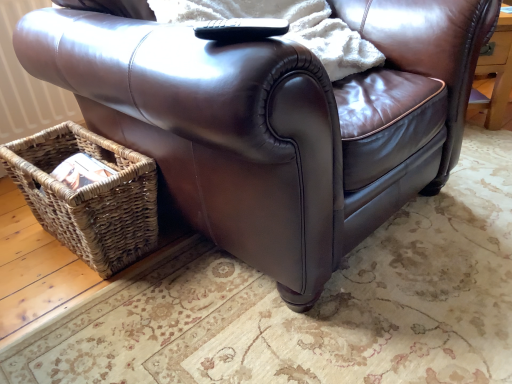
Identify the location of woven brown picnic basket at lower left. (88, 196).

Describe the element at coordinates (88, 196) in the screenshot. I see `woven brown picnic basket at lower left` at that location.

Where is `black plastic remote at upper center`? The height and width of the screenshot is (384, 512). black plastic remote at upper center is located at coordinates (240, 29).

The image size is (512, 384). What do you see at coordinates (240, 29) in the screenshot?
I see `black plastic remote at upper center` at bounding box center [240, 29].

Measure the distance between black plastic remote at upper center and camera.

26.32 inches.

Locate an element on the screen. This screenshot has width=512, height=384. woven brown picnic basket at lower left is located at coordinates (88, 196).

Is black plastic remote at upper center to the right of woven brown picnic basket at lower left from the viewer's perspective?

Correct, you'll find black plastic remote at upper center to the right of woven brown picnic basket at lower left.

Who is more distant, black plastic remote at upper center or woven brown picnic basket at lower left?

woven brown picnic basket at lower left is further away from the camera.

Which is nearer, (x=229, y=36) or (x=9, y=169)?

Clearly, point (x=229, y=36) is closer to the camera than point (x=9, y=169).

From the image's perspective, relative to woven brown picnic basket at lower left, is black plastic remote at upper center above or below?

black plastic remote at upper center is situated higher than woven brown picnic basket at lower left in the image.

From a real-world perspective, is black plastic remote at upper center below woven brown picnic basket at lower left?

Actually, black plastic remote at upper center is physically above woven brown picnic basket at lower left in the real world.

Which object is thinner, black plastic remote at upper center or woven brown picnic basket at lower left?

Thinner between the two is black plastic remote at upper center.

Can you confirm if black plastic remote at upper center is taller than woven brown picnic basket at lower left?

In fact, black plastic remote at upper center may be shorter than woven brown picnic basket at lower left.

Is black plastic remote at upper center bigger than woven brown picnic basket at lower left?

No.

Can we say black plastic remote at upper center lies outside woven brown picnic basket at lower left?

black plastic remote at upper center lies outside woven brown picnic basket at lower left's area.

Consider the image. Is black plastic remote at upper center next to woven brown picnic basket at lower left?

No, black plastic remote at upper center is not beside woven brown picnic basket at lower left.

Is black plastic remote at upper center facing away from woven brown picnic basket at lower left?

That's not correct — black plastic remote at upper center is not looking away from woven brown picnic basket at lower left.

Identify the location of picnic basket behind the black plastic remote at upper center. (88, 196).

Which object is positioned more to the right, woven brown picnic basket at lower left or black plastic remote at upper center?

From the viewer's perspective, black plastic remote at upper center appears more on the right side.

Between woven brown picnic basket at lower left and black plastic remote at upper center, which one is positioned behind?

woven brown picnic basket at lower left is behind.

Does point (108, 261) appear closer or farther from the camera than point (196, 34)?

Point (108, 261) is positioned farther from the camera compared to point (196, 34).

From the image's perspective, who appears lower, woven brown picnic basket at lower left or black plastic remote at upper center?

woven brown picnic basket at lower left.

From a real-world perspective, is woven brown picnic basket at lower left physically located above or below black plastic remote at upper center?

Clearly, from a real-world perspective, woven brown picnic basket at lower left is below black plastic remote at upper center.

Can you confirm if woven brown picnic basket at lower left is wider than black plastic remote at upper center?

Indeed, woven brown picnic basket at lower left has a greater width compared to black plastic remote at upper center.

Does woven brown picnic basket at lower left have a lesser height compared to black plastic remote at upper center?

Incorrect, the height of woven brown picnic basket at lower left does not fall short of that of black plastic remote at upper center.

Between woven brown picnic basket at lower left and black plastic remote at upper center, which one has smaller size?

Smaller between the two is black plastic remote at upper center.

Is woven brown picnic basket at lower left situated inside black plastic remote at upper center or outside?

woven brown picnic basket at lower left cannot be found inside black plastic remote at upper center.

Can you see woven brown picnic basket at lower left touching black plastic remote at upper center?

They are not placed beside each other.

Is woven brown picnic basket at lower left facing away from black plastic remote at upper center?

No.

At what (x,y) coordinates should I click in order to perform the action: click on picnic basket below the black plastic remote at upper center (from a real-world perspective). Please return your answer as a coordinate pair (x, y). The image size is (512, 384). Looking at the image, I should click on (88, 196).

Find the location of a particular element. picnic basket located on the left of black plastic remote at upper center is located at coordinates point(88,196).

At what (x,y) coordinates should I click in order to perform the action: click on remote on the right of woven brown picnic basket at lower left. Please return your answer as a coordinate pair (x, y). Image resolution: width=512 pixels, height=384 pixels. Looking at the image, I should click on (240, 29).